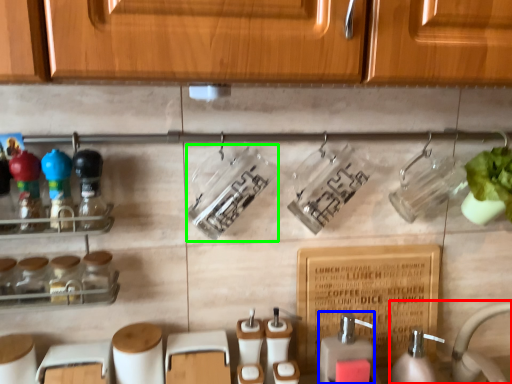
Question: Estimate the real-world distances between objects in this image. Which object is farther from sink (highlighted by a red box), soap dispenser (highlighted by a blue box) or bottle (highlighted by a green box)?

Choices:
 (A) soap dispenser
 (B) bottle

Answer: (B)